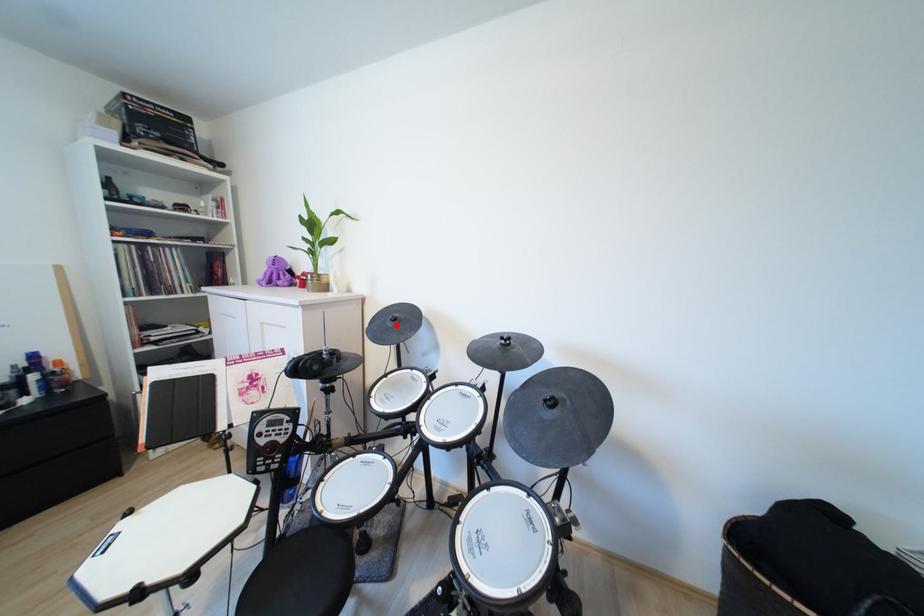
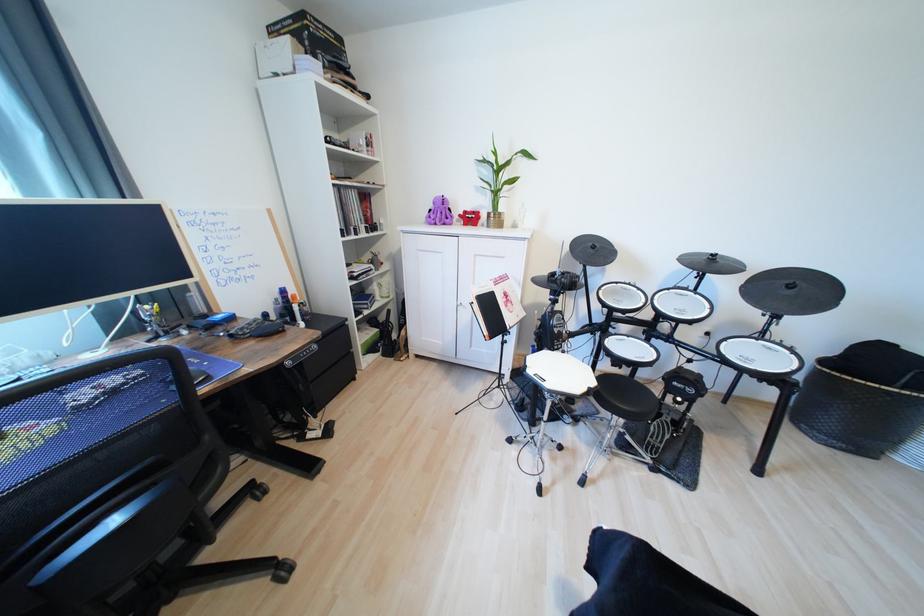
The point at the highlighted location is marked in the first image. Where is the corresponding point in the second image?

(599, 252)